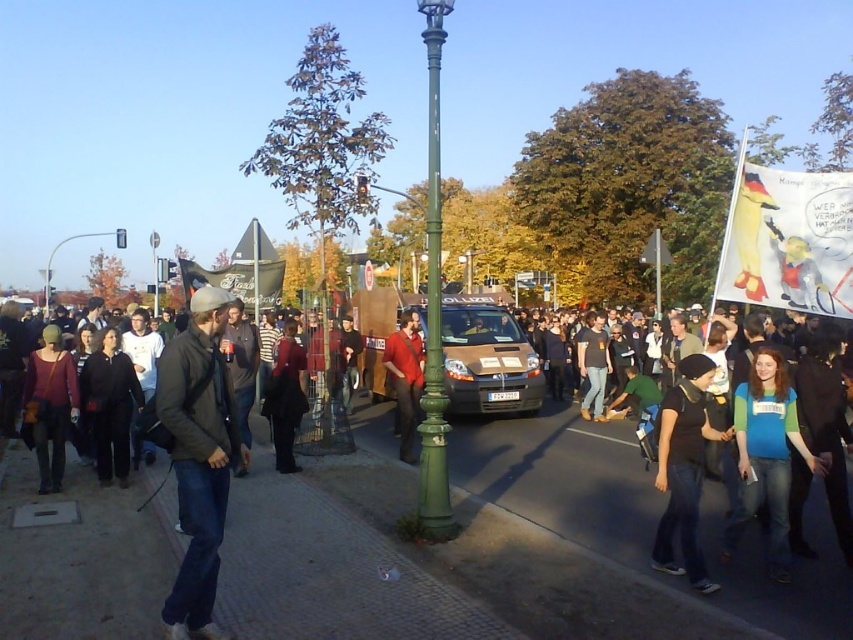
Question: Can you confirm if green painted metal pole at center is smaller than matte red sweater at left?

Choices:
 (A) no
 (B) yes

Answer: (A)

Question: Can you confirm if blue-green t-shirt at center-right is wider than black matte jacket at lower right?

Choices:
 (A) no
 (B) yes

Answer: (B)

Question: Is dark gray jacket at center closer to the viewer compared to matte red shirt at center?

Choices:
 (A) yes
 (B) no

Answer: (A)

Question: Which of the following is the farthest from the observer?

Choices:
 (A) matte red shirt at center
 (B) metallic pole at upper left

Answer: (B)

Question: Among these objects, which one is farthest from the camera?

Choices:
 (A) green painted metal pole at center
 (B) metallic pole at upper left
 (C) brushed metal streetlamp at upper center

Answer: (B)

Question: Considering the real-world distances, which object is farthest from the green painted metal pole at center?

Choices:
 (A) brushed metal streetlamp at upper center
 (B) matte red sweater at left

Answer: (A)